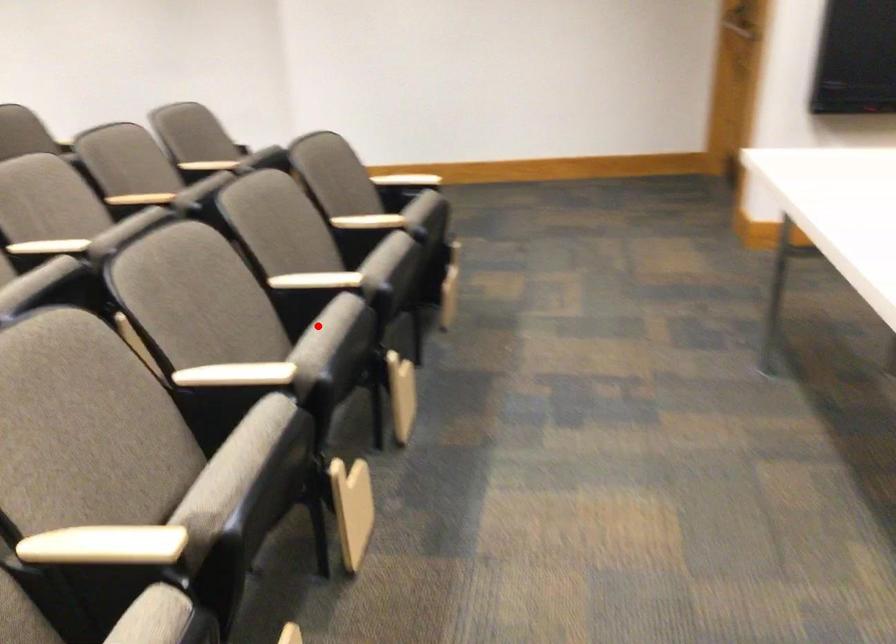
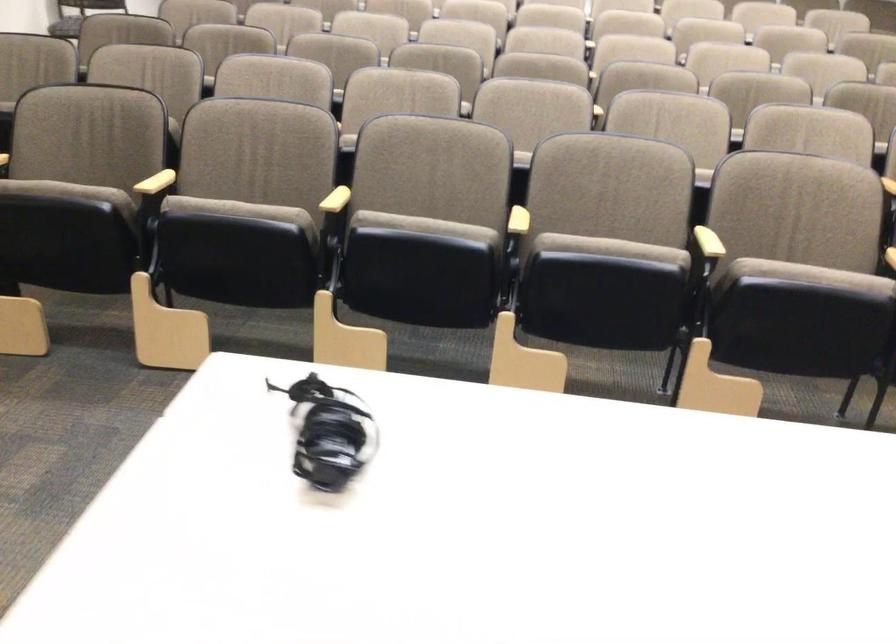
Where in the second image is the point corresponding to the highlighted location from the first image?

(610, 249)